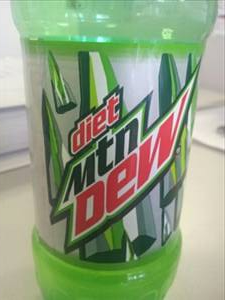
Image resolution: width=225 pixels, height=300 pixels. In order to click on white surface in this screenshot , I will do `click(211, 197)`, `click(12, 81)`.